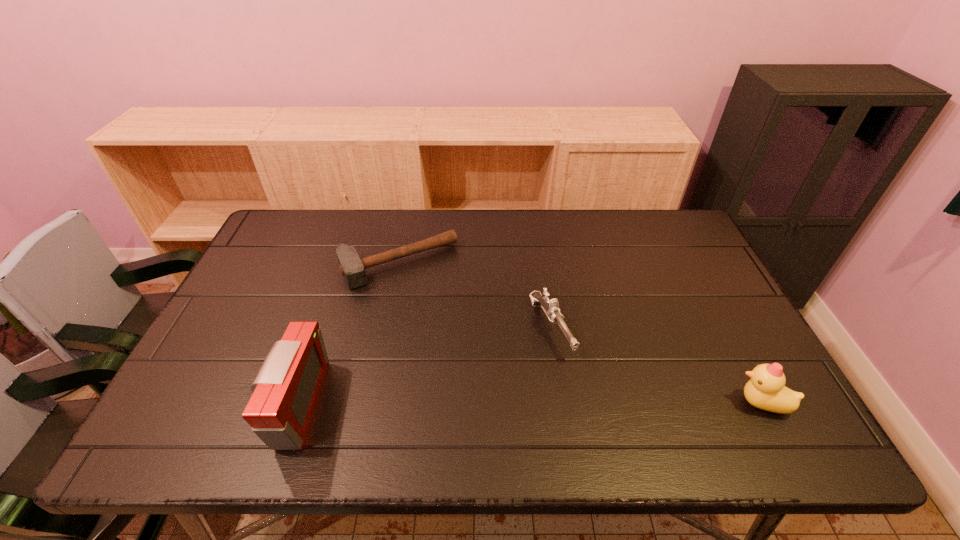
I want to click on vacant region located on the front-facing side of the rightmost object, so click(687, 403).

In order to click on free space located 0.060m on the front-facing side of the rightmost object in this screenshot , I will do `click(708, 403)`.

Locate an element on the screen. The image size is (960, 540). vacant space located 0.050m on the front-facing side of the rightmost object is located at coordinates (713, 403).

Identify the location of vacant space situated aimed along the barrel of the gun. This screenshot has height=540, width=960. (577, 388).

The width and height of the screenshot is (960, 540). Identify the location of vacant space situated 0.200m on the striking surface of the hammer. (450, 335).

At what (x,y) coordinates should I click in order to perform the action: click on free point located 0.310m on the striking surface of the hammer. Please return your answer as a coordinate pair (x, y). The width and height of the screenshot is (960, 540). Looking at the image, I should click on (468, 366).

At what (x,y) coordinates should I click in order to perform the action: click on free space located 0.350m on the striking surface of the hammer. Please return your answer as a coordinate pair (x, y). The width and height of the screenshot is (960, 540). Looking at the image, I should click on (475, 377).

Where is `object that is at the far edge`? This screenshot has height=540, width=960. object that is at the far edge is located at coordinates (351, 266).

This screenshot has height=540, width=960. In order to click on camera that is at the near edge in this screenshot , I will do point(286,390).

Where is `duckling that is at the near edge`? The image size is (960, 540). duckling that is at the near edge is located at coordinates (766, 390).